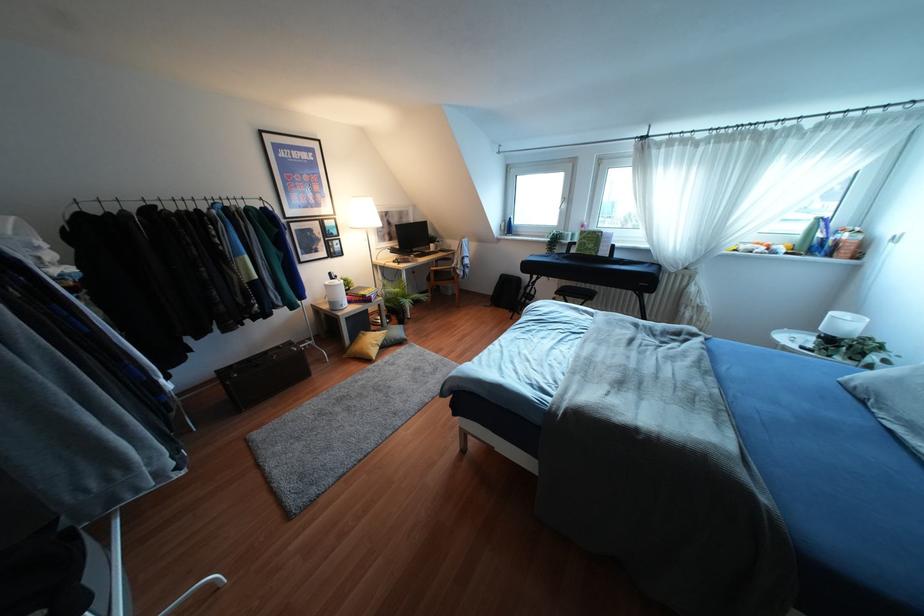
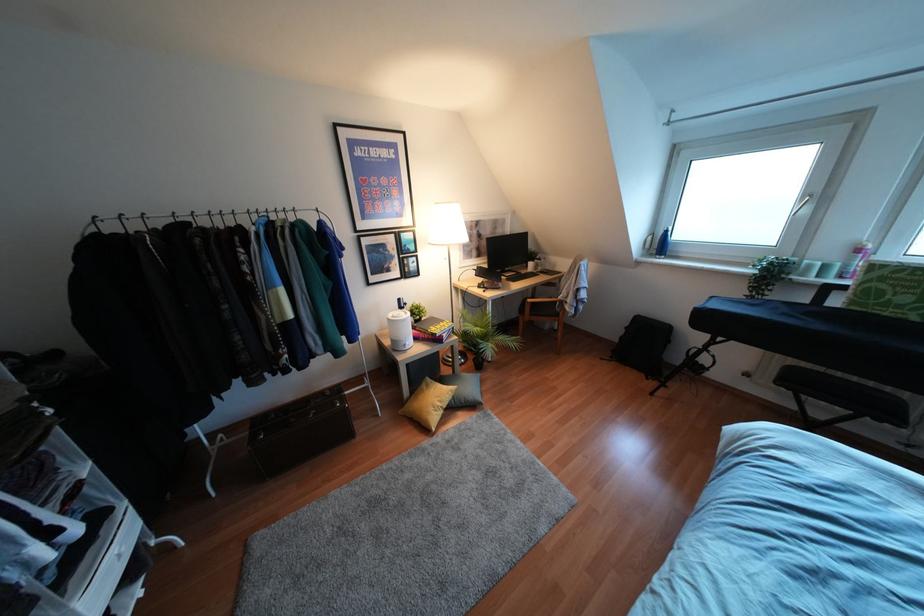
The point at (581,225) is marked in the first image. Where is the corresponding point in the second image?

(858, 249)